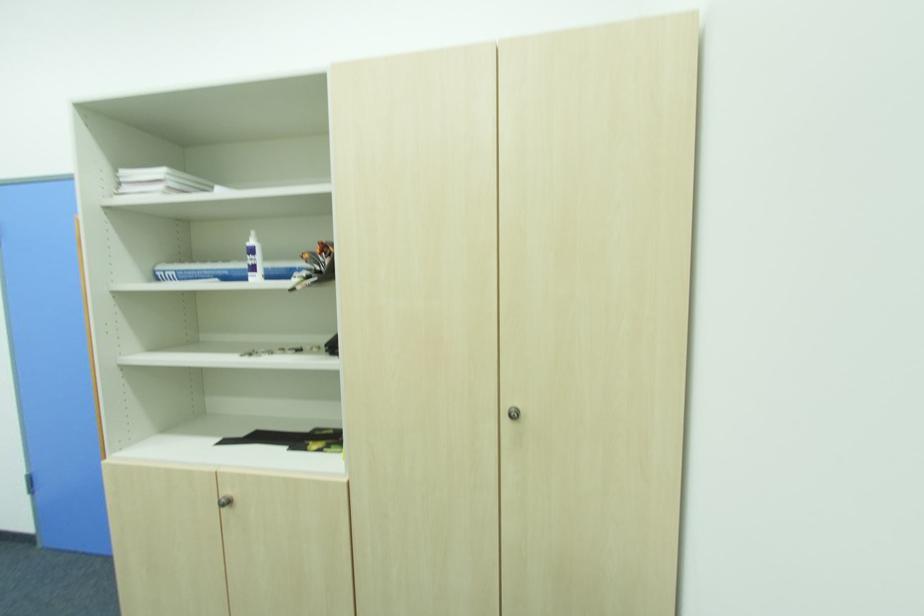
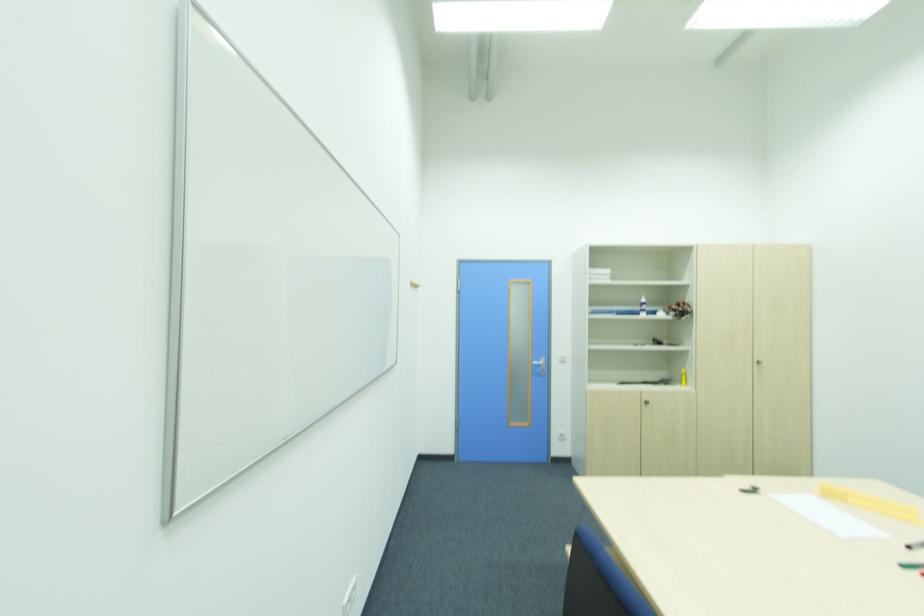
Locate, in the second image, the point that corresponds to the point at 251,241 in the first image.

(643, 301)